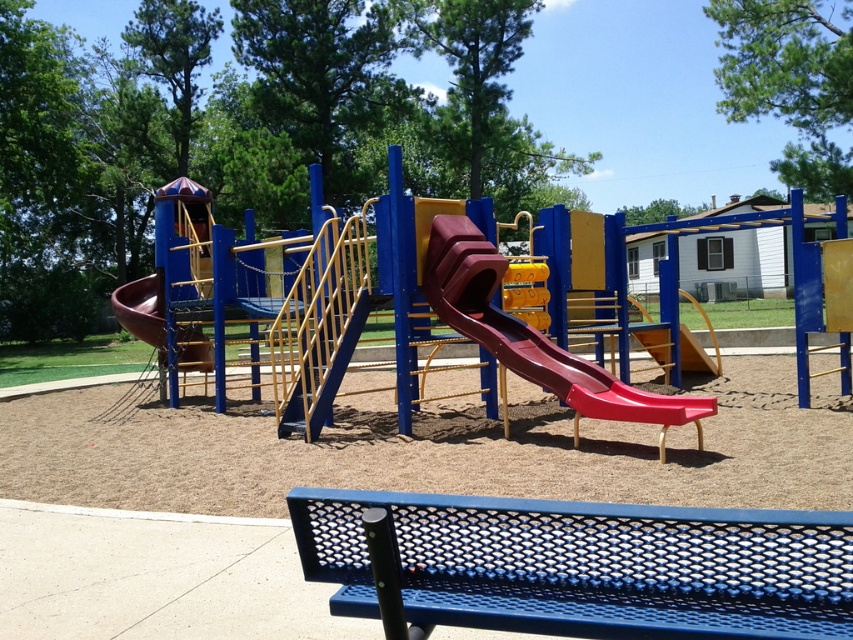
Question: Which object appears closest to the camera in this image?

Choices:
 (A) brown matte slide at left
 (B) blue perforated metal bench at center

Answer: (B)

Question: Which of the following is the farthest from the observer?

Choices:
 (A) brown matte slide at left
 (B) rubberized smooth slide at center
 (C) blue perforated metal bench at center

Answer: (A)

Question: Which point is farther from the camera taking this photo?

Choices:
 (A) (158, 356)
 (B) (432, 298)
 (C) (476, 611)

Answer: (A)

Question: Is blue perforated metal bench at center smaller than brown matte slide at left?

Choices:
 (A) no
 (B) yes

Answer: (B)

Question: Does rubberized smooth slide at center have a lesser width compared to brown matte slide at left?

Choices:
 (A) yes
 (B) no

Answer: (B)

Question: Does rubberized smooth slide at center appear over brown matte slide at left?

Choices:
 (A) no
 (B) yes

Answer: (A)